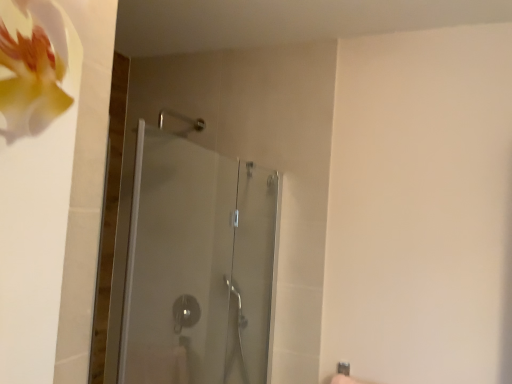
Question: Should I look upward or downward to see transparent glass shower door at center?

Choices:
 (A) down
 (B) up

Answer: (A)